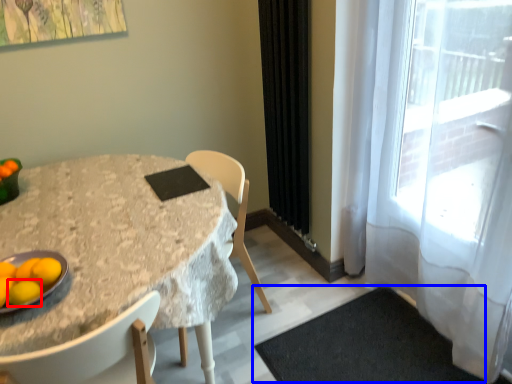
Question: Which of the following is the closest to the observer, lemon (highlighted by a red box) or doormat (highlighted by a blue box)?

Choices:
 (A) lemon
 (B) doormat

Answer: (A)